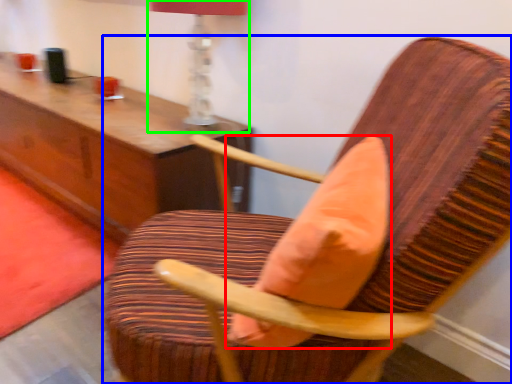
Question: Considering the real-world distances, which object is closest to throw pillow (highlighted by a red box)? chair (highlighted by a blue box) or table lamp (highlighted by a green box).

Choices:
 (A) chair
 (B) table lamp

Answer: (A)